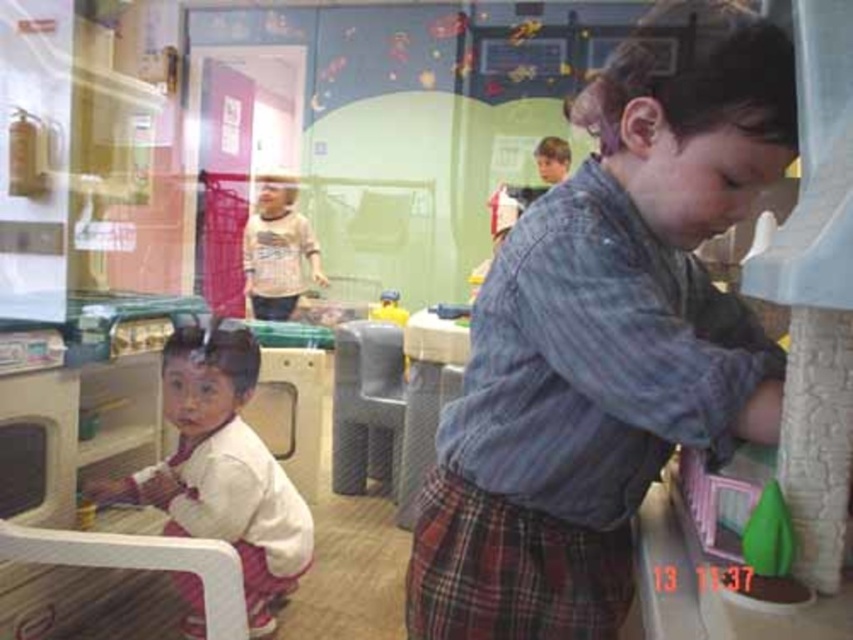
Question: Among these points, which one is farthest from the camera?

Choices:
 (A) (379, 307)
 (B) (556, 604)
 (C) (221, 339)
 (D) (494, 376)

Answer: (A)

Question: Is blue plaid skirt at center to the left of white matte shirt at center from the viewer's perspective?

Choices:
 (A) yes
 (B) no

Answer: (B)

Question: Can you confirm if plaid fabric skirt at lower center is thinner than matte gray chair at center?

Choices:
 (A) no
 (B) yes

Answer: (A)

Question: Which point appears closest to the camera in this image?

Choices:
 (A) [775, 480]
 (B) [373, 230]

Answer: (A)

Question: Among these points, which one is farthest from the camera?

Choices:
 (A) (379, 470)
 (B) (297, 257)
 (C) (392, 291)
 (D) (181, 381)

Answer: (A)

Question: Does blue plaid skirt at center have a smaller size compared to yellow plastic toy at center?

Choices:
 (A) yes
 (B) no

Answer: (B)